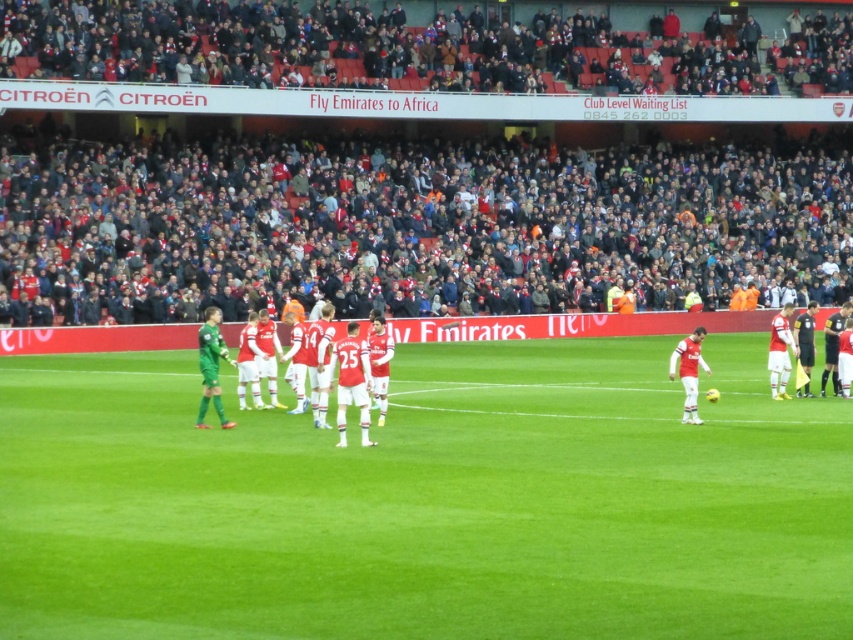
You are a photographer at the soccer match. You want to capture a photo where both the dark gray crowd at upper center and the white jersey players at center are visible. Which object should be placed closer to the camera to ensure both are in focus?

The dark gray crowd at upper center has a greater height compared to white jersey players at center, so to ensure both are in focus, the photographer should place the white jersey players at center closer to the camera.

You are a drone operator trying to capture aerial footage of the soccer match. The camera is currently positioned at point A. To ensure the green grass field at center is centered in the frame, which direction should you move the camera? The field is located at coordinate point 0.784, 0.502. Please respond with either left, right, up, or down.

The green grass field at center is located at coordinate point (427, 500). To center it in the frame, move the camera to the right.